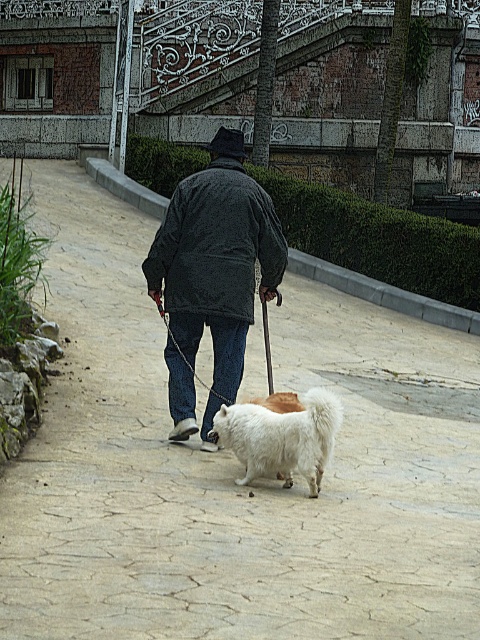
You are a photographer trying to capture the dark gray fleece jacket at center in your shot. The camera you are using has a sensor that can only detect objects within a 0.4x0.4 meter area. Given that the jacket is located at point 0.381, 0.450, will the jacket fit entirely within the sensor area?

The dark gray fleece jacket at center is located at point (216, 243). Since the sensor area is 0.4x0.4 meters, the jacket will fit entirely within the sensor area as its position is within the sensor range.

You are a photographer positioned to capture the scene of the elderly person and their dog. You want to ensure both the dark gray fleece jacket at center and the white fluffy dog at center are in focus. Which object should you adjust your camera focus on first to ensure depth of field?

The dark gray fleece jacket at center is further to the viewer than the white fluffy dog at center. To ensure both are in focus, you should first focus on the white fluffy dog at center since it is farther away, allowing the depth of field to cover both subjects.